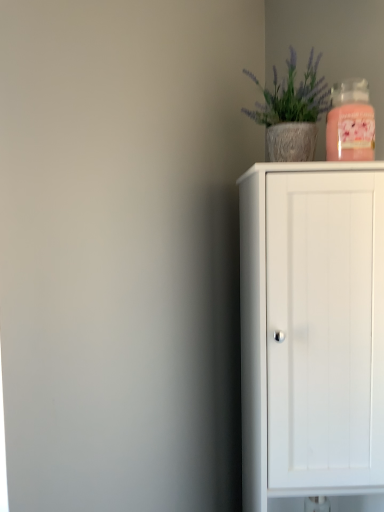
Find the location of a particular element. pink glass candle at upper right is located at coordinates tap(350, 122).

This screenshot has width=384, height=512. Describe the element at coordinates (350, 122) in the screenshot. I see `pink glass candle at upper right` at that location.

The height and width of the screenshot is (512, 384). Describe the element at coordinates (311, 329) in the screenshot. I see `white matte cabinet at right` at that location.

Measure the distance between point (x=290, y=97) and camera.

Point (x=290, y=97) and camera are 97.90 centimeters apart.

Describe the element at coordinates (291, 112) in the screenshot. The width and height of the screenshot is (384, 512). I see `textured concrete pot at upper right` at that location.

The image size is (384, 512). In order to click on pink glass candle at upper right in this screenshot , I will do `click(350, 122)`.

The height and width of the screenshot is (512, 384). What are the coordinates of `bottle on the right of the textured concrete pot at upper right` in the screenshot? It's located at (350, 122).

Looking at this image, does pink glass candle at upper right lie in front of textured concrete pot at upper right?

Yes, the depth of pink glass candle at upper right is less than that of textured concrete pot at upper right.

Is pink glass candle at upper right not within textured concrete pot at upper right?

Indeed, pink glass candle at upper right is completely outside textured concrete pot at upper right.

Looking at this image, from a real-world perspective, who is located higher, pink glass candle at upper right or textured concrete pot at upper right?

textured concrete pot at upper right, from a real-world perspective.

Is pink glass candle at upper right not inside white matte cabinet at right?

Yes.

Who is more distant, pink glass candle at upper right or white matte cabinet at right?

pink glass candle at upper right is behind.

Can you tell me how much pink glass candle at upper right and white matte cabinet at right differ in facing direction?

There is a 1.59-degree angle between the facing directions of pink glass candle at upper right and white matte cabinet at right.

Considering the sizes of pink glass candle at upper right and white matte cabinet at right in the image, is pink glass candle at upper right bigger or smaller than white matte cabinet at right?

In the image, pink glass candle at upper right appears to be smaller than white matte cabinet at right.

You are a GUI agent. You are given a task and a screenshot of the screen. Output one action in this format:
    pyautogui.click(x=<x>, y=<y>)
    Task: Click on the cupboard located underneath the textured concrete pot at upper right (from a real-world perspective)
    
    Given the screenshot: What is the action you would take?
    pyautogui.click(x=311, y=329)

Who is more distant, white matte cabinet at right or textured concrete pot at upper right?

textured concrete pot at upper right is further away from the camera.

From a real-world perspective, is white matte cabinet at right positioned above or below textured concrete pot at upper right?

white matte cabinet at right is situated lower than textured concrete pot at upper right in the real world.

From the image's perspective, is white matte cabinet at right located above or below textured concrete pot at upper right?

Clearly, from the image's perspective, white matte cabinet at right is below textured concrete pot at upper right.

Considering the relative sizes of textured concrete pot at upper right and white matte cabinet at right in the image provided, is textured concrete pot at upper right smaller than white matte cabinet at right?

Yes, textured concrete pot at upper right is smaller than white matte cabinet at right.

From the image's perspective, between textured concrete pot at upper right and white matte cabinet at right, which one is located above?

textured concrete pot at upper right, from the image's perspective.

Is textured concrete pot at upper right inside or outside of white matte cabinet at right?

textured concrete pot at upper right is located beyond the bounds of white matte cabinet at right.

Is white matte cabinet at right closer to camera compared to pink glass candle at upper right?

Yes, it is.

Can you tell me how much white matte cabinet at right and pink glass candle at upper right differ in facing direction?

The facing directions of white matte cabinet at right and pink glass candle at upper right are 1.59 degrees apart.

Identify the location of bottle that is above the white matte cabinet at right (from a real-world perspective). (350, 122).

Is point (343, 302) positioned behind point (361, 123)?

Yes, point (343, 302) is farther from viewer.

Is pink glass candle at upper right at the back of textured concrete pot at upper right?

No, textured concrete pot at upper right is not facing the opposite direction of pink glass candle at upper right.

Is textured concrete pot at upper right with pink glass candle at upper right?

No, textured concrete pot at upper right is not making contact with pink glass candle at upper right.

Can you confirm if textured concrete pot at upper right is positioned to the left of pink glass candle at upper right?

Yes.

Where is `bottle located on the right of textured concrete pot at upper right`? This screenshot has width=384, height=512. bottle located on the right of textured concrete pot at upper right is located at coordinates (350, 122).

You are a GUI agent. You are given a task and a screenshot of the screen. Output one action in this format:
    pyautogui.click(x=<x>, y=<y>)
    Task: Click on the bottle above the white matte cabinet at right (from the image's perspective)
    
    Given the screenshot: What is the action you would take?
    pyautogui.click(x=350, y=122)

Based on the photo, based on their spatial positions, is textured concrete pot at upper right or white matte cabinet at right closer to pink glass candle at upper right?

textured concrete pot at upper right lies closer to pink glass candle at upper right than the other object.

From the image, which object appears to be farther from pink glass candle at upper right, white matte cabinet at right or textured concrete pot at upper right?

Based on the image, white matte cabinet at right appears to be further to pink glass candle at upper right.

When comparing their distances from textured concrete pot at upper right, does white matte cabinet at right or pink glass candle at upper right seem closer?

pink glass candle at upper right is closer to textured concrete pot at upper right.

When comparing their distances from white matte cabinet at right, does textured concrete pot at upper right or pink glass candle at upper right seem closer?

Based on the image, pink glass candle at upper right appears to be nearer to white matte cabinet at right.

From the image, which object appears to be nearer to textured concrete pot at upper right, pink glass candle at upper right or white matte cabinet at right?

pink glass candle at upper right is closer to textured concrete pot at upper right.

Based on their spatial positions, is pink glass candle at upper right or textured concrete pot at upper right closer to white matte cabinet at right?

Among the two, pink glass candle at upper right is located nearer to white matte cabinet at right.

The width and height of the screenshot is (384, 512). What are the coordinates of `bottle between textured concrete pot at upper right and white matte cabinet at right vertically` in the screenshot? It's located at (350, 122).